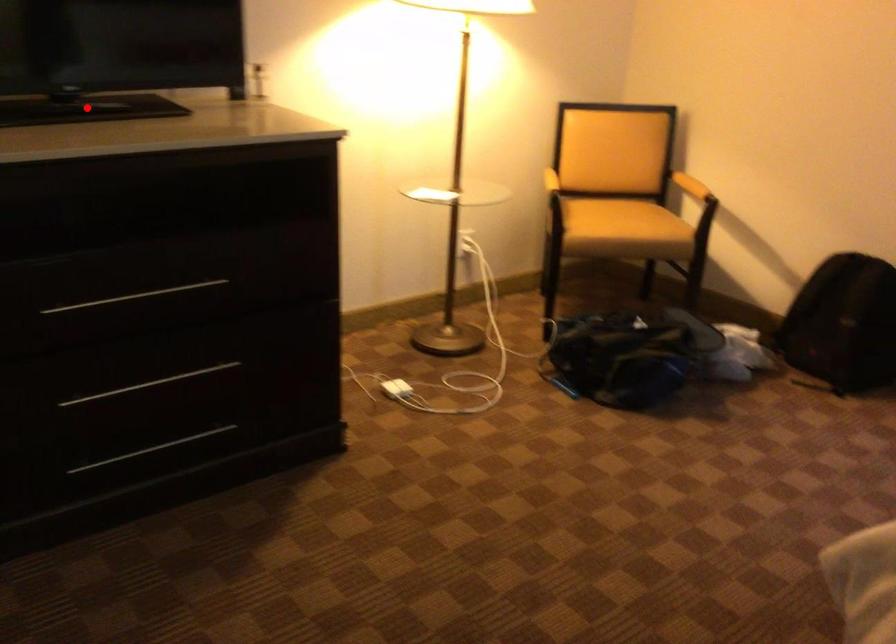
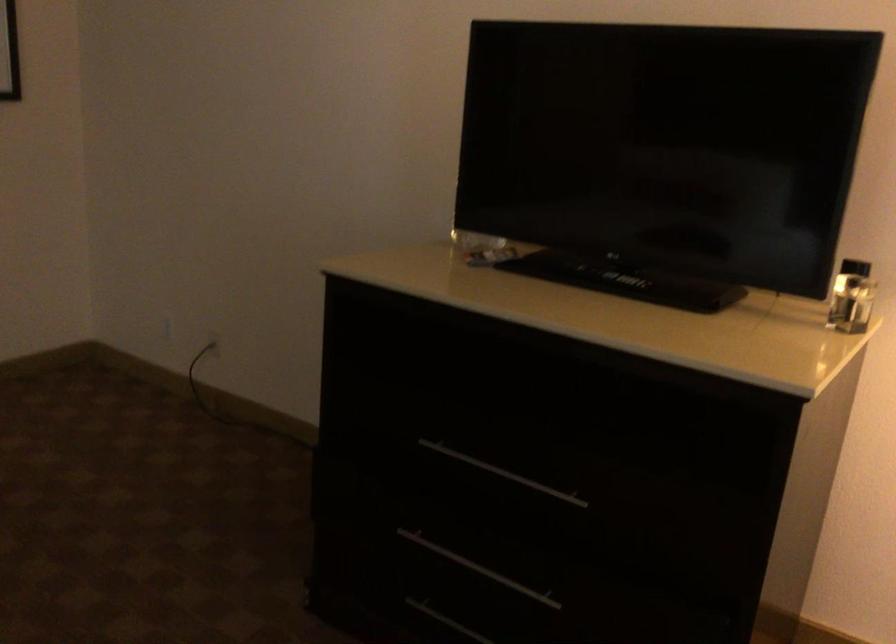
Question: I am providing you with two images of the same scene from different viewpoints. A red point is marked on the first image. Is the red point's position out of view in image 2?

Choices:
 (A) Yes
 (B) No

Answer: (B)